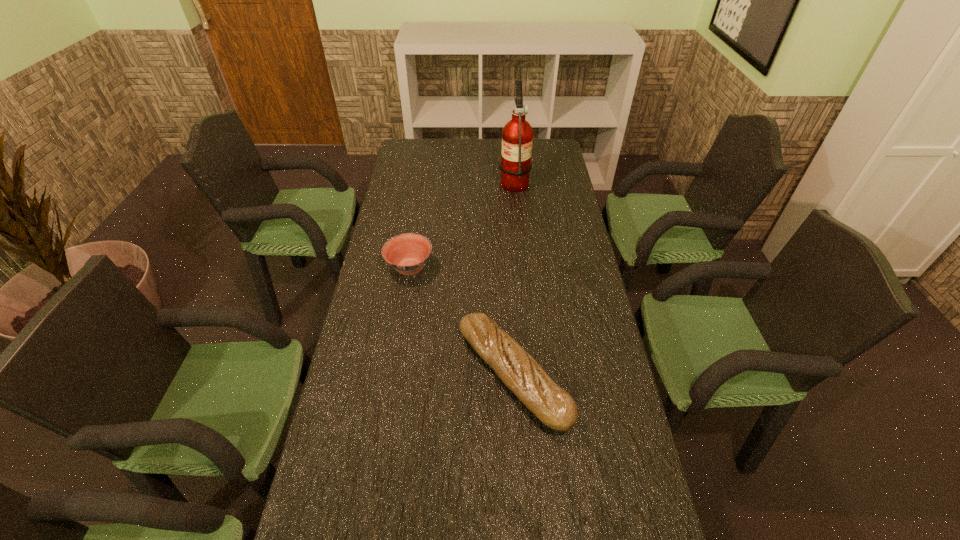
The height and width of the screenshot is (540, 960). In order to click on object that is the closest to the bowl in this screenshot , I will do `click(552, 405)`.

I want to click on the second closest object to the second farthest object, so click(x=517, y=136).